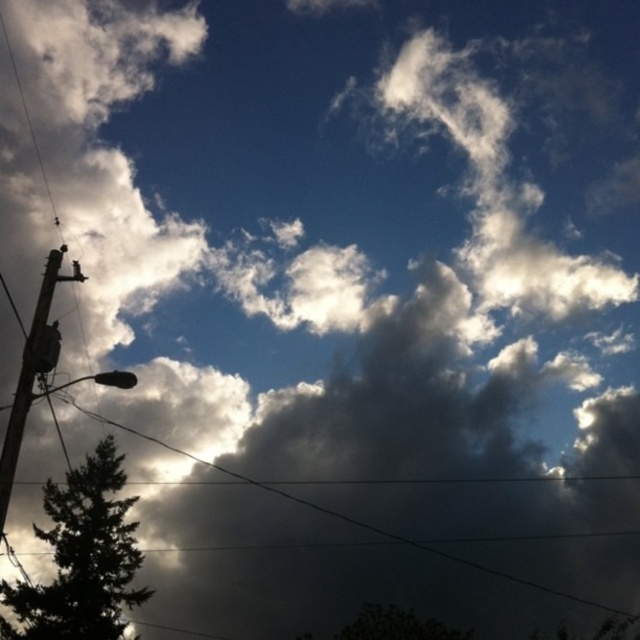
Based on the coordinates provided, where is the dark green leafy tree at lower left located in the image?

The dark green leafy tree at lower left is located at coordinates point (83, 557).